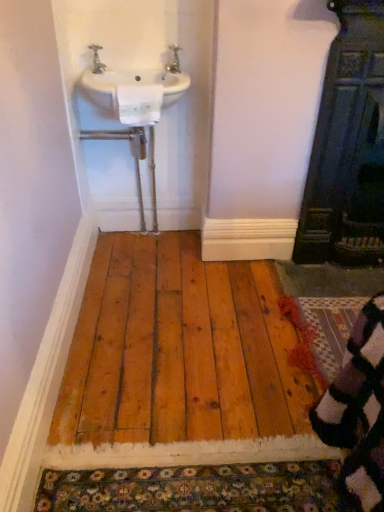
Question: In terms of width, does multicolored knitted rug at lower right look wider or thinner when compared to white ceramic sink at upper left?

Choices:
 (A) thin
 (B) wide

Answer: (B)

Question: Is multicolored knitted rug at lower right to the left or to the right of white ceramic sink at upper left in the image?

Choices:
 (A) right
 (B) left

Answer: (A)

Question: Estimate the real-world distances between objects in this image. Which object is farther from the metallic silver faucet at upper left, acting as the second tap starting from the right?

Choices:
 (A) dark wood door at right
 (B) white ceramic sink at upper left
 (C) natural wood floor at center
 (D) silver metallic tap at upper center, the first tap in the right-to-left sequence
 (E) multicolored knitted rug at lower right

Answer: (E)

Question: Estimate the real-world distances between objects in this image. Which object is farther from the multicolored knitted rug at lower right?

Choices:
 (A) dark wood door at right
 (B) silver metallic tap at upper center, the first tap in the right-to-left sequence
 (C) white ceramic sink at upper left
 (D) natural wood floor at center
 (E) metallic silver faucet at upper left, the first tap when ordered from left to right

Answer: (E)